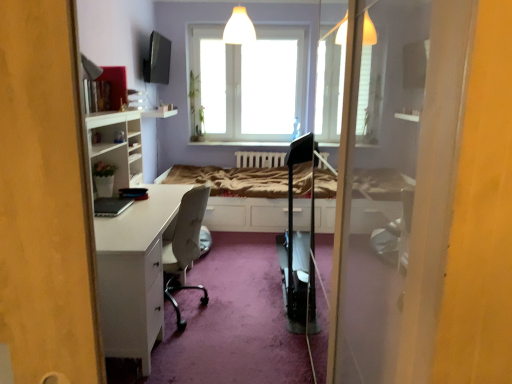
This screenshot has height=384, width=512. What do you see at coordinates (234, 180) in the screenshot?
I see `white wooden bed frame at center` at bounding box center [234, 180].

Measure the distance between transparent glass window at center and camera.

transparent glass window at center and camera are 4.75 meters apart from each other.

Find the location of a particular element. white glossy desk at left is located at coordinates (135, 273).

Which of these two, white glossy desk at left or transparent glass window at center, is thinner?

transparent glass window at center.

From a real-world perspective, which object rests below the other?

white glossy desk at left is physically lower.

Considering the positions of point (105, 283) and point (221, 109), is point (105, 283) closer or farther from the camera than point (221, 109)?

Point (105, 283) is closer to the camera than point (221, 109).

Which object is closer to the camera, white glossy desk at left or transparent glass window at center?

white glossy desk at left is closer to the camera.

Is white wooden bed frame at center aimed at white glossy desk at left?

Yes.

From the image's perspective, relative to white glossy desk at left, is white wooden bed frame at center above or below?

From the image's perspective, white wooden bed frame at center appears above white glossy desk at left.

Does white wooden bed frame at center lie behind white glossy desk at left?

Yes, white wooden bed frame at center is behind white glossy desk at left.

Which of these two, transparent glass window at center or white wooden bed frame at center, is wider?

Wider between the two is white wooden bed frame at center.

Based on their sizes in the image, would you say transparent glass window at center is bigger or smaller than white wooden bed frame at center?

transparent glass window at center is smaller than white wooden bed frame at center.

From a real-world perspective, which is physically below, transparent glass window at center or white wooden bed frame at center?

white wooden bed frame at center.

From the image's perspective, is transparent glass window at center on white wooden bed frame at center?

Yes.

From a real-world perspective, is white glossy desk at left over white wooden bed frame at center?

Actually, white glossy desk at left is physically below white wooden bed frame at center in the real world.

Is white glossy desk at left in front of white wooden bed frame at center?

Yes, white glossy desk at left is closer to the viewer.

Is white wooden bed frame at center at the back of white glossy desk at left?

No, white glossy desk at left is not facing away from white wooden bed frame at center.

Are transparent glass window at center and white glossy desk at left beside each other?

They are not placed beside each other.

From the image's perspective, is transparent glass window at center positioned above or below white glossy desk at left?

Clearly, from the image's perspective, transparent glass window at center is above white glossy desk at left.

From a real-world perspective, is transparent glass window at center below white glossy desk at left?

No, from a real-world perspective, transparent glass window at center is not under white glossy desk at left.

In terms of size, does transparent glass window at center appear bigger or smaller than white glossy desk at left?

Considering their sizes, transparent glass window at center takes up more space than white glossy desk at left.

Between white wooden bed frame at center and transparent glass window at center, which one has less height?

With less height is white wooden bed frame at center.

At what (x,y) coordinates should I click in order to perform the action: click on window that appears above the white wooden bed frame at center (from a real-world perspective). Please return your answer as a coordinate pair (x, y). The height and width of the screenshot is (384, 512). Looking at the image, I should click on (251, 83).

Are white wooden bed frame at center and transparent glass window at center making contact?

There is a gap between white wooden bed frame at center and transparent glass window at center.

Is point (254, 189) closer to viewer compared to point (226, 92)?

That is True.

Locate an element on the screen. The height and width of the screenshot is (384, 512). window on the right of white glossy desk at left is located at coordinates (251, 83).

Find the location of a particular element. This screenshot has width=512, height=384. bed frame that appears behind the white glossy desk at left is located at coordinates (234, 180).

Based on their spatial positions, is transparent glass window at center or white glossy desk at left closer to white wooden bed frame at center?

Among the two, transparent glass window at center is located nearer to white wooden bed frame at center.

Considering their positions, is white glossy desk at left positioned closer to transparent glass window at center than white wooden bed frame at center?

The object closer to transparent glass window at center is white wooden bed frame at center.

Looking at the image, which one is located further to white glossy desk at left, white wooden bed frame at center or transparent glass window at center?

The object further to white glossy desk at left is transparent glass window at center.

When comparing their distances from white wooden bed frame at center, does white glossy desk at left or transparent glass window at center seem further?

Among the two, white glossy desk at left is located further to white wooden bed frame at center.

Considering their positions, is transparent glass window at center positioned closer to white glossy desk at left than white wooden bed frame at center?

white wooden bed frame at center is closer to white glossy desk at left.

Considering their positions, is white wooden bed frame at center positioned further to transparent glass window at center than white glossy desk at left?

white glossy desk at left.

Find the location of `bed frame between white glossy desk at left and transparent glass window at center along the z-axis`. bed frame between white glossy desk at left and transparent glass window at center along the z-axis is located at coordinates (234, 180).